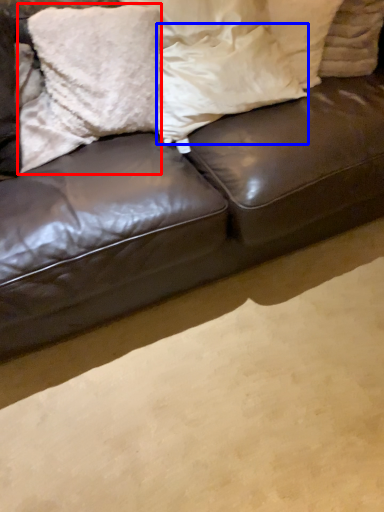
Question: Among these objects, which one is nearest to the camera, pillow (highlighted by a red box) or pillow (highlighted by a blue box)?

Choices:
 (A) pillow
 (B) pillow

Answer: (B)